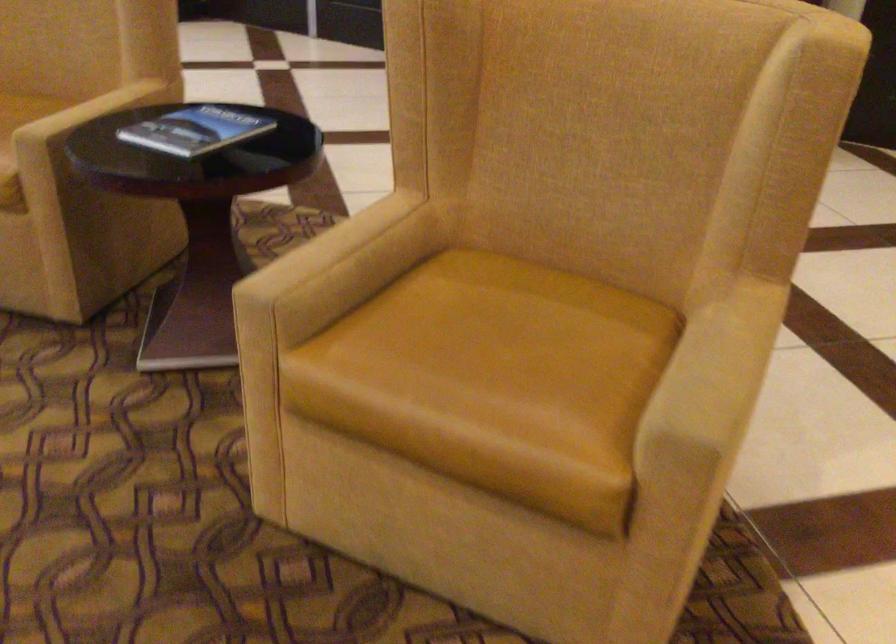
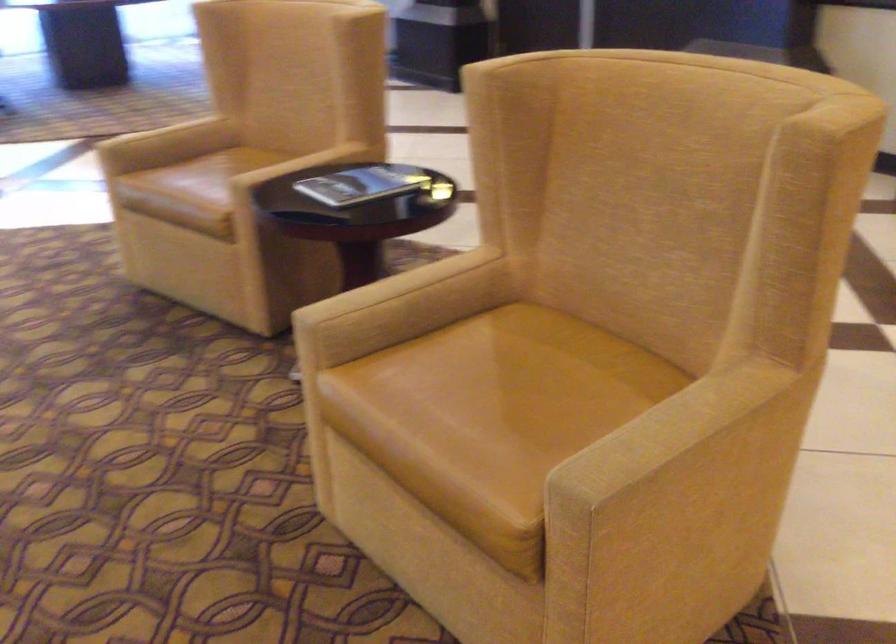
Find the pixel in the second image that matches the point at 753,357 in the first image.

(707, 433)